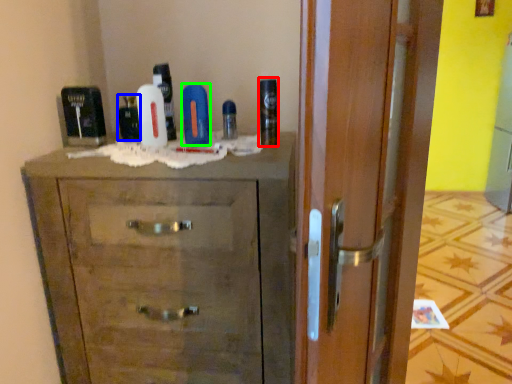
Question: Considering the real-world distances, which object is farthest from shaving cream (highlighted by a red box)? mouthwash (highlighted by a blue box) or toiletry (highlighted by a green box)?

Choices:
 (A) mouthwash
 (B) toiletry

Answer: (A)